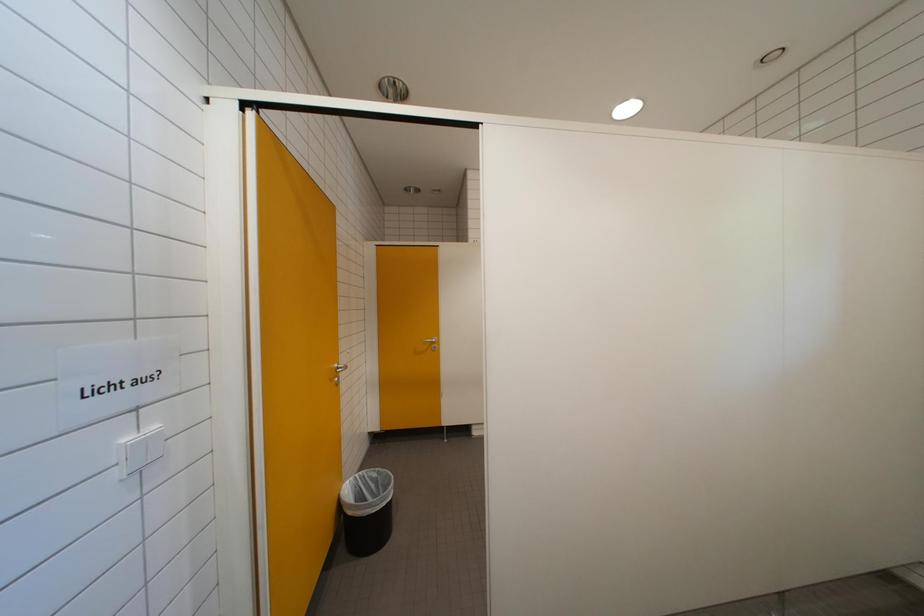
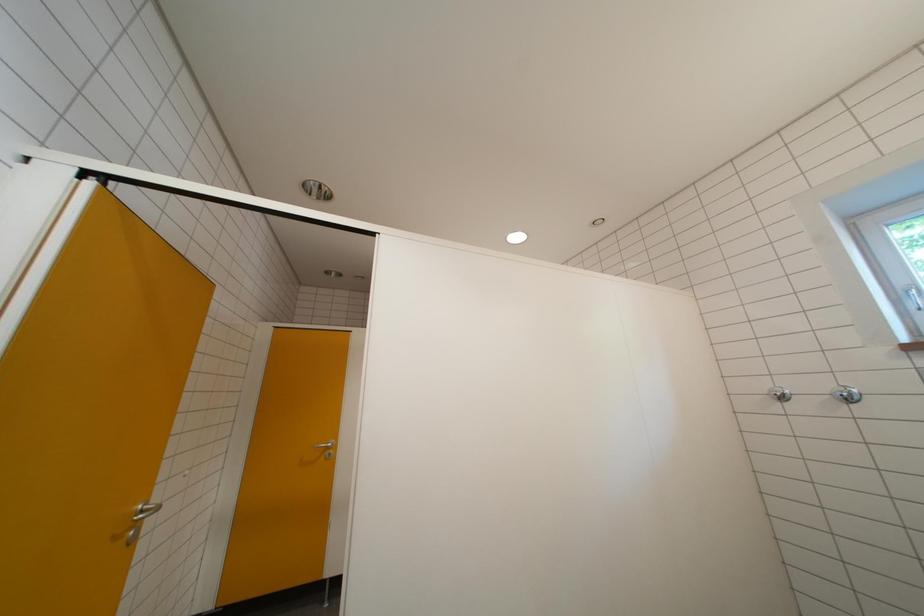
Question: Which direction would the cameraman need to move to produce the second image? Reply with the corresponding letter.

Choices:
 (A) Left
 (B) Right
 (C) Forward
 (D) Backward

Answer: (B)